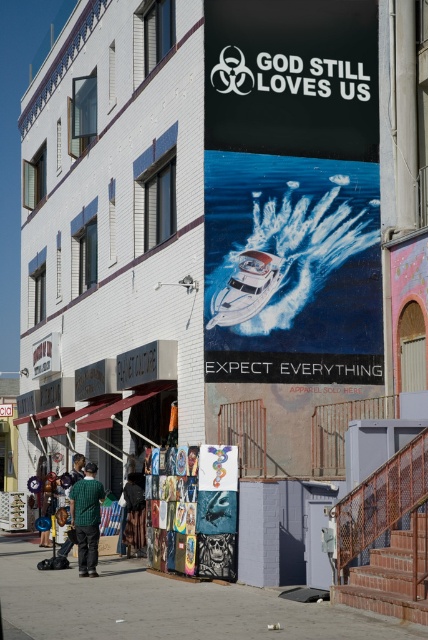
Question: Can you confirm if matte black signboard at upper center is positioned to the left of white glossy boat at center?

Choices:
 (A) yes
 (B) no

Answer: (B)

Question: Which point is farther to the camera?

Choices:
 (A) (372, 252)
 (B) (256, 304)

Answer: (A)

Question: Among these objects, which one is nearest to the camera?

Choices:
 (A) matte black signboard at upper center
 (B) metallic silver paintings at center
 (C) green checkered shirt at lower left

Answer: (B)

Question: Can you confirm if metallic silver paintings at center is positioned below white glossy boat at center?

Choices:
 (A) yes
 (B) no

Answer: (A)

Question: Observing the image, what is the correct spatial positioning of metallic silver paintings at center in reference to green checkered shirt at lower left?

Choices:
 (A) left
 (B) right

Answer: (B)

Question: Which object is farther from the camera taking this photo?

Choices:
 (A) metallic silver paintings at center
 (B) matte black signboard at upper center

Answer: (B)